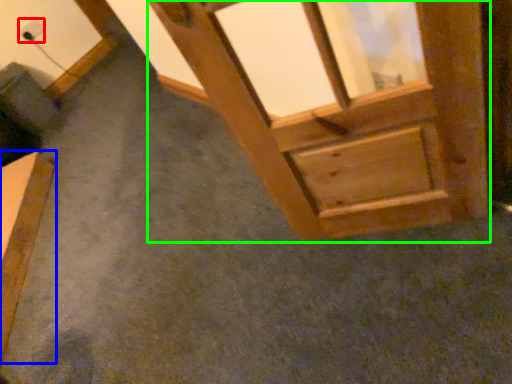
Question: Which object is the closest to the electric outlet (highlighted by a red box)? Choose among these: furniture (highlighted by a blue box) or window frame (highlighted by a green box).

Choices:
 (A) furniture
 (B) window frame

Answer: (A)